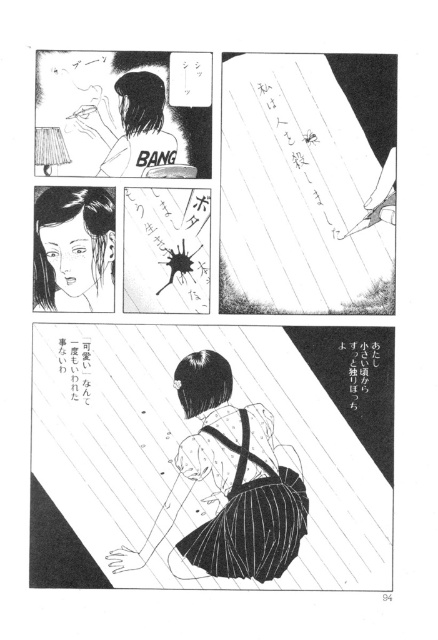
Question: Which point is farther to the camera?

Choices:
 (A) black paper at lower right
 (B) black paper at lower left

Answer: (B)

Question: Which is farther from the smooth black hair at center?

Choices:
 (A) black paper at lower right
 (B) black paper at lower left

Answer: (A)

Question: Can you confirm if black striped skirt at center is positioned below black paper at lower right?

Choices:
 (A) no
 (B) yes

Answer: (B)

Question: Is smooth black hair at center further to camera compared to black paper at lower left?

Choices:
 (A) no
 (B) yes

Answer: (A)

Question: Which is nearer to the smooth black hair at center?

Choices:
 (A) black paper at lower left
 (B) black paper at lower right
 (C) black striped skirt at center

Answer: (A)

Question: Is smooth black hair at center below black paper at lower right?

Choices:
 (A) no
 (B) yes

Answer: (A)